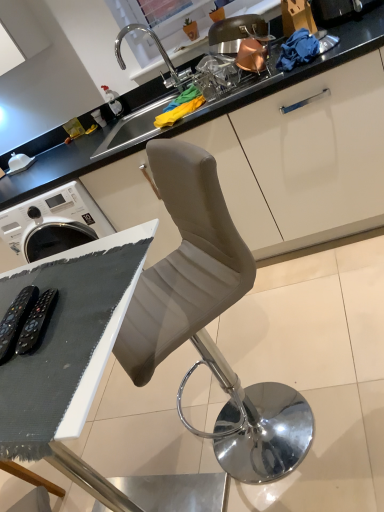
Question: From a real-world perspective, relative to matte white cabinet at upper center, is suede-like gray chair at center vertically above or below?

Choices:
 (A) below
 (B) above

Answer: (A)

Question: Do you think suede-like gray chair at center is within matte white cabinet at upper center, or outside of it?

Choices:
 (A) inside
 (B) outside

Answer: (B)

Question: Which object is positioned farthest from the white matte table at lower left?

Choices:
 (A) matte white cabinet at upper center
 (B) suede-like gray chair at center
 (C) satin nickel sink at upper center

Answer: (C)

Question: Which of these objects is positioned closest to the white matte table at lower left?

Choices:
 (A) matte white cabinet at upper center
 (B) suede-like gray chair at center
 (C) satin nickel sink at upper center

Answer: (B)